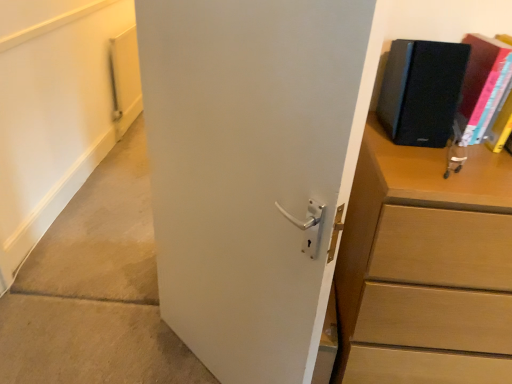
This screenshot has width=512, height=384. What are the coordinates of `vacant area that is in front of matte black book at upper right, arranged as the 1th paperback book when viewed from the right` in the screenshot? It's located at (466, 161).